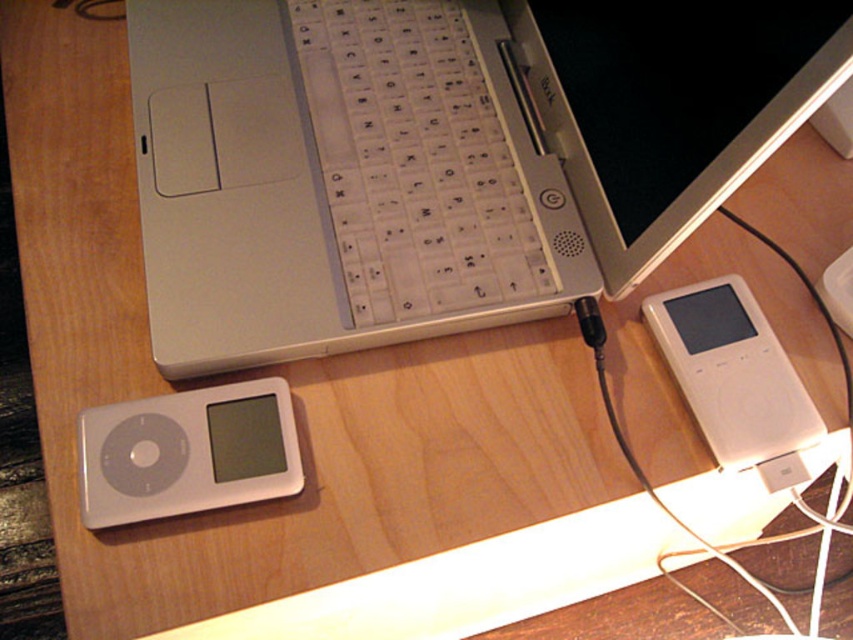
Does white plastic keyboard at center appear over white glossy ipod at lower left?

Indeed, white plastic keyboard at center is positioned over white glossy ipod at lower left.

Who is more distant from viewer, (503,177) or (277,381)?

Positioned behind is point (503,177).

Does point (354, 241) come in front of point (202, 492)?

No.

Image resolution: width=853 pixels, height=640 pixels. In order to click on white plastic keyboard at center in this screenshot , I will do [x=415, y=161].

Can you confirm if white glossy ipod at lower left is thinner than white plastic ipod at right?

Incorrect, white glossy ipod at lower left's width is not less than white plastic ipod at right's.

Does white glossy ipod at lower left appear under white plastic ipod at right?

Indeed, white glossy ipod at lower left is positioned under white plastic ipod at right.

At what (x,y) coordinates should I click in order to perform the action: click on white glossy ipod at lower left. Please return your answer as a coordinate pair (x, y). Looking at the image, I should click on (187, 452).

Consider the image. Between white plastic keyboard at center and white plastic ipod at right, which one is positioned higher?

white plastic keyboard at center is above.

From the picture: Does white plastic keyboard at center have a greater width compared to white plastic ipod at right?

Yes.

Who is more forward, (473, 276) or (665, 332)?

Point (665, 332) is more forward.

At what (x,y) coordinates should I click in order to perform the action: click on white plastic keyboard at center. Please return your answer as a coordinate pair (x, y). The image size is (853, 640). Looking at the image, I should click on (415, 161).